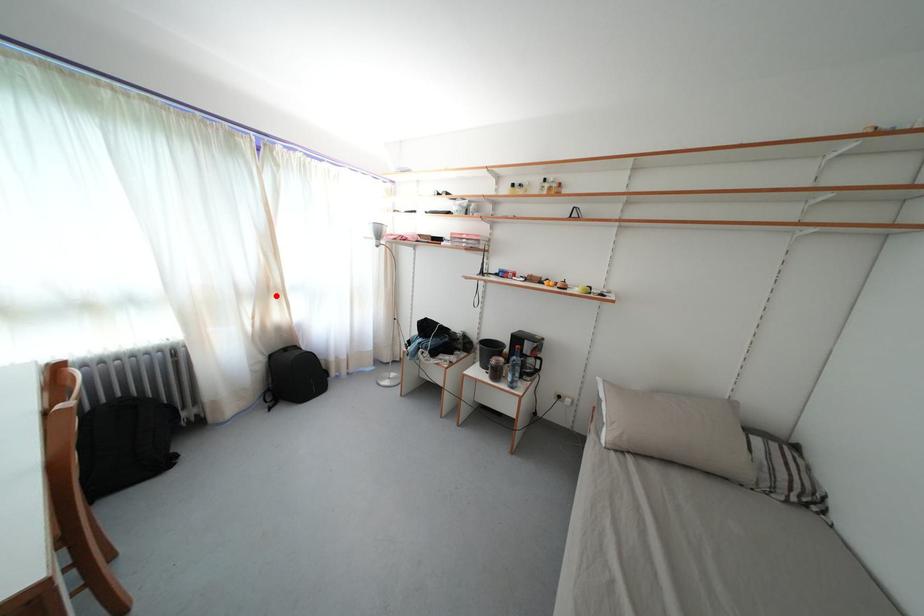
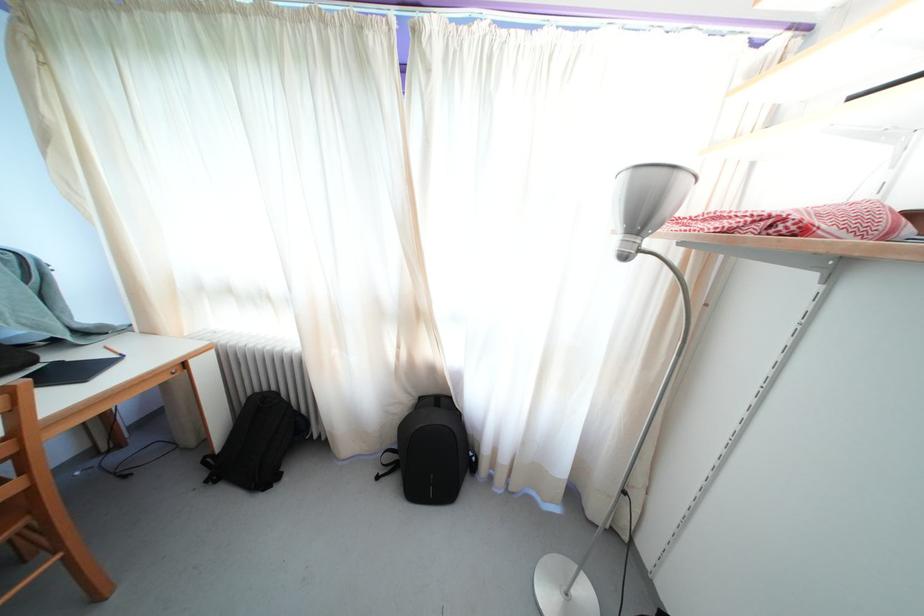
Locate, in the second image, the point that corresponds to the highlighted location in the first image.

(421, 321)